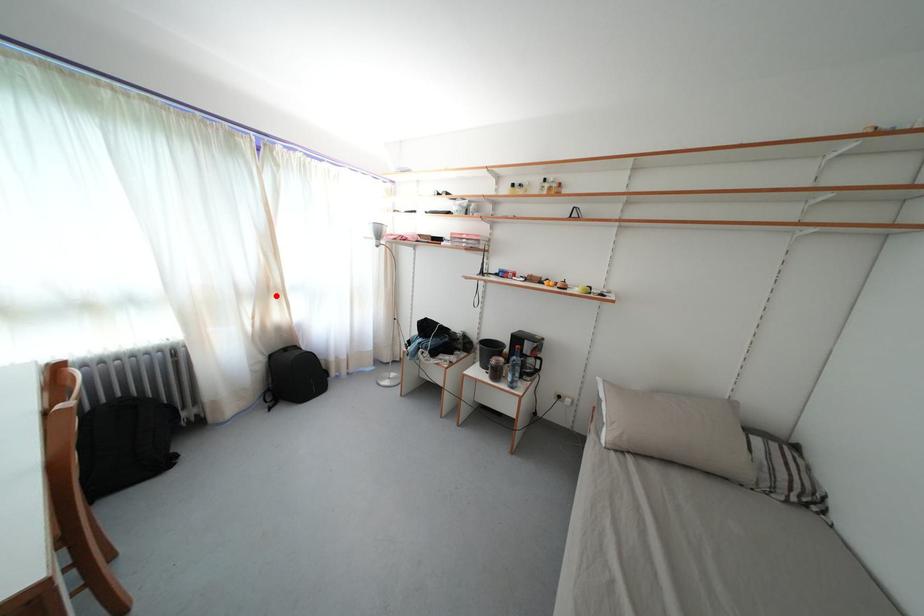
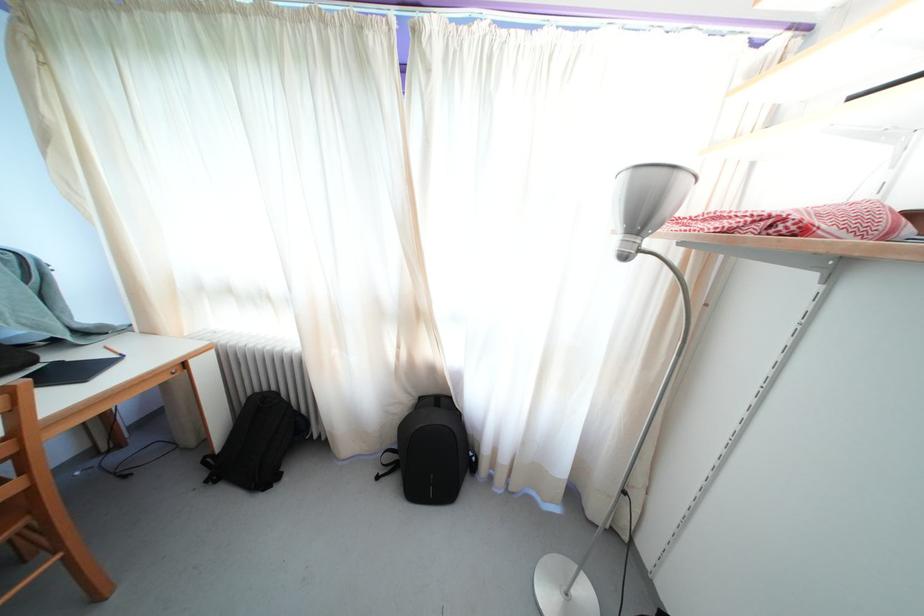
Locate, in the second image, the point that corresponds to the highlighted location in the first image.

(421, 321)